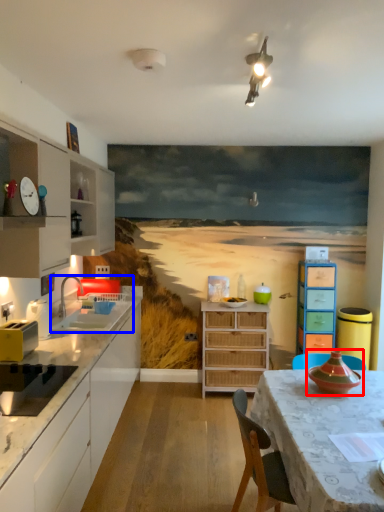
Question: Which point is further to the camera, appliance (highlighted by a red box) or sink (highlighted by a blue box)?

Choices:
 (A) appliance
 (B) sink

Answer: (B)